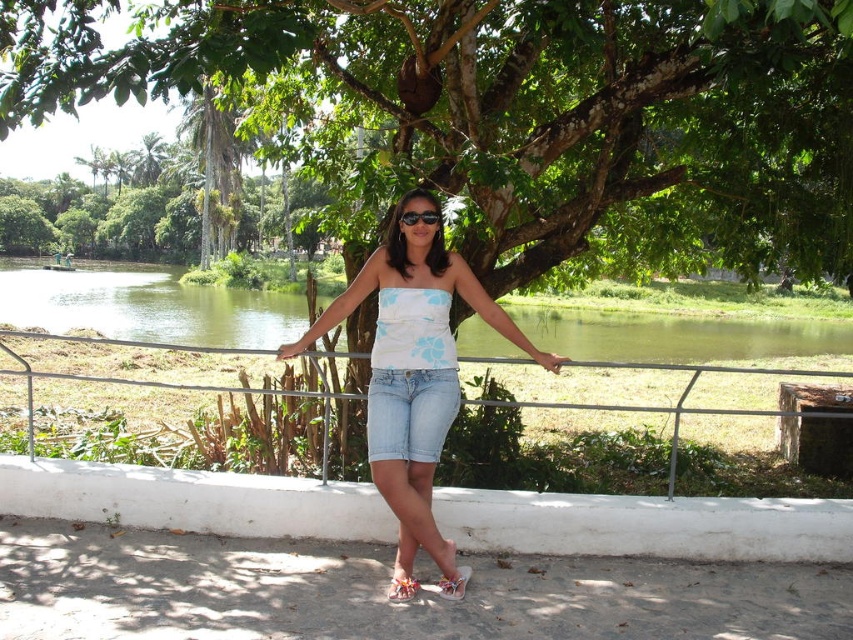
Question: Which point is closer to the camera?

Choices:
 (A) white concrete ledge at lower center
 (B) metallic silver fence at center
 (C) white cotton tank top at center
 (D) floral fabric sandal at lower center

Answer: (D)

Question: Is the position of green leafy tree at center less distant than that of floral fabric sandal at lower center?

Choices:
 (A) no
 (B) yes

Answer: (B)

Question: Which of these objects is positioned farthest from the floral fabric sandal at lower center?

Choices:
 (A) light blue denim shorts at center
 (B) white fabric sandal at lower center
 (C) black plastic sunglasses at center
 (D) green leafy tree at center

Answer: (D)

Question: Does white concrete ledge at lower center appear under light blue denim shorts at center?

Choices:
 (A) yes
 (B) no

Answer: (A)

Question: Estimate the real-world distances between objects in this image. Which object is closer to the light blue denim shorts at center?

Choices:
 (A) white concrete ledge at lower center
 (B) black plastic sunglasses at center
 (C) metallic silver fence at center
 (D) white fabric sandal at lower center

Answer: (D)

Question: Can you confirm if green leafy tree at center is thinner than light blue denim shorts at center?

Choices:
 (A) yes
 (B) no

Answer: (B)